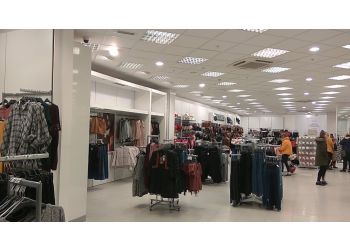
At what (x,y) coordinates should I click in order to perform the action: click on circle ceiling lights. Please return your answer as a coordinate pair (x, y). The width and height of the screenshot is (350, 250). Looking at the image, I should click on (160, 63), (203, 87), (224, 97), (313, 51), (308, 79), (306, 94), (314, 102), (238, 103).